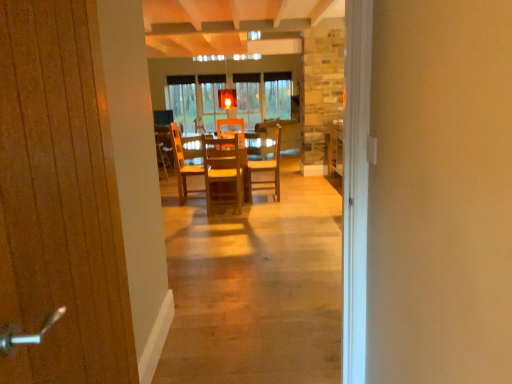
You are a GUI agent. You are given a task and a screenshot of the screen. Output one action in this format:
    pyautogui.click(x=<x>, y=<y>)
    Task: Click on the wooden door at left
    Image resolution: width=512 pixels, height=384 pixels.
    Given the screenshot: What is the action you would take?
    pyautogui.click(x=62, y=193)

In order to face wooden table at center, should I rotate leftwards or rightwards?

It's best to rotate left around 3.550 degrees.

Image resolution: width=512 pixels, height=384 pixels. I want to click on wooden chair at center, so click(x=164, y=148).

The image size is (512, 384). Identify the location of wooden door at left. (62, 193).

How many degrees apart are the facing directions of wooden door at left and wooden table at center?

86.9 degrees separate the facing orientations of wooden door at left and wooden table at center.

Which object is more forward, wooden door at left or wooden table at center?

wooden door at left is closer to the camera.

Considering the sizes of objects wooden door at left and wooden table at center in the image provided, who is thinner, wooden door at left or wooden table at center?

wooden door at left.

Which is more to the right, wooden door at left or wooden table at center?

Positioned to the right is wooden table at center.

Is point (215, 149) less distant than point (74, 173)?

No, it is behind (74, 173).

Consider the image. Which object is positioned more to the left, wooden chair at center, which appears as the first chair when viewed from the front, or wooden door at left?

wooden door at left is more to the left.

The height and width of the screenshot is (384, 512). Find the location of `the 1st chair below the wooden door at left (from a real-world perspective)`. the 1st chair below the wooden door at left (from a real-world perspective) is located at coordinates 223,171.

In terms of height, does wooden chair at center, arranged as the 2th chair when viewed from the right, look taller or shorter compared to wooden door at left?

Considering their sizes, wooden chair at center, arranged as the 2th chair when viewed from the right, has less height than wooden door at left.

Locate an element on the screen. Image resolution: width=512 pixels, height=384 pixels. chair located in front of the wooden table at center is located at coordinates [x=223, y=171].

Is wooden chair at center, which appears as the first chair when viewed from the front, oriented towards wooden table at center?

Yes, wooden chair at center, which appears as the first chair when viewed from the front, is turned towards wooden table at center.

Is the position of wooden chair at center, which appears as the first chair when viewed from the front, less distant than that of wooden table at center?

Yes, wooden chair at center, which appears as the first chair when viewed from the front, is in front of wooden table at center.

Between wooden chair at center, arranged as the 2th chair when viewed from the right, and wooden table at center, which one has larger width?

wooden table at center is wider.

Based on the photo, is wooden chair at center, the second chair in the back-to-front sequence, with wooden chair at center, arranged as the first chair when viewed from the right?

No, wooden chair at center, the second chair in the back-to-front sequence, is not touching wooden chair at center, arranged as the first chair when viewed from the right.

Can you confirm if wooden chair at center, which appears as the first chair when viewed from the front, is thinner than wooden chair at center, which appears as the first chair when viewed from the back?

Yes, wooden chair at center, which appears as the first chair when viewed from the front, is thinner than wooden chair at center, which appears as the first chair when viewed from the back.

Considering the sizes of objects wooden chair at center, the second chair in the back-to-front sequence, and wooden chair at center, arranged as the first chair when viewed from the right, in the image provided, who is shorter, wooden chair at center, the second chair in the back-to-front sequence, or wooden chair at center, arranged as the first chair when viewed from the right,?

Standing shorter between the two is wooden chair at center, the second chair in the back-to-front sequence.

Based on their sizes in the image, would you say wooden chair at center, which appears as the first chair when viewed from the front, is bigger or smaller than wooden chair at center, the 2th chair positioned from the left?

Clearly, wooden chair at center, which appears as the first chair when viewed from the front, is larger in size than wooden chair at center, the 2th chair positioned from the left.

Between point (163, 169) and point (240, 125), which one is positioned in front?

The point (240, 125) is more forward.

What's the angular difference between wooden chair at center and wooden table at center's facing directions?

The facing directions of wooden chair at center and wooden table at center are 92.2 degrees apart.

Does wooden chair at center turn towards wooden table at center?

No, wooden chair at center is not aimed at wooden table at center.

From a real-world perspective, is wooden chair at center beneath wooden table at center?

No, from a real-world perspective, wooden chair at center is not below wooden table at center.

Is point (228, 177) in front of point (163, 160)?

That is True.

Considering the positions of objects wooden chair at center, which appears as the first chair when viewed from the front, and wooden chair at center in the image provided, who is more to the left, wooden chair at center, which appears as the first chair when viewed from the front, or wooden chair at center?

Positioned to the left is wooden chair at center.

Which of these two, wooden chair at center, the 1th chair positioned from the left, or wooden chair at center, is smaller?

wooden chair at center is smaller.

From a real-world perspective, is wooden chair at center, the 1th chair positioned from the left, positioned above or below wooden chair at center?

Result: From a real-world perspective, wooden chair at center, the 1th chair positioned from the left, is physically above wooden chair at center.

From a real-world perspective, is wooden table at center above or below wooden chair at center, which appears as the first chair when viewed from the front?

Clearly, from a real-world perspective, wooden table at center is below wooden chair at center, which appears as the first chair when viewed from the front.

Which is farther from the camera, (255, 135) or (223, 172)?

Point (255, 135)

From the image's perspective, relative to wooden chair at center, arranged as the 2th chair when viewed from the right, is wooden table at center above or below?

Based on their image positions, wooden table at center is located above wooden chair at center, arranged as the 2th chair when viewed from the right.

Considering the relative sizes of wooden table at center and wooden chair at center, which appears as the first chair when viewed from the front, in the image provided, is wooden table at center bigger than wooden chair at center, which appears as the first chair when viewed from the front,?

Yes, wooden table at center is bigger than wooden chair at center, which appears as the first chair when viewed from the front.

This screenshot has height=384, width=512. Identify the location of kitchen & dining room table below the wooden door at left (from a real-world perspective). (269, 163).

Locate an element on the screen. Image resolution: width=512 pixels, height=384 pixels. door in front of the wooden chair at center, arranged as the 2th chair when viewed from the right is located at coordinates (62, 193).

Considering their positions, is wooden chair at center positioned further to wooden chair at center, arranged as the 2th chair when viewed from the front, than wooden table at center?

wooden chair at center is positioned further to the anchor wooden chair at center, arranged as the 2th chair when viewed from the front.

Looking at the image, which one is located closer to wooden chair at center, the 2th chair positioned from the left, wooden table at center or wooden chair at center?

The object closer to wooden chair at center, the 2th chair positioned from the left, is wooden table at center.

Looking at the image, which one is located closer to wooden chair at center, which appears as the first chair when viewed from the front, wooden door at left or wooden table at center?

wooden table at center lies closer to wooden chair at center, which appears as the first chair when viewed from the front, than the other object.

Looking at the image, which one is located closer to wooden table at center, wooden chair at center, arranged as the 2th chair when viewed from the right, or wooden chair at center?

wooden chair at center.

When comparing their distances from wooden table at center, does wooden door at left or wooden chair at center, arranged as the 2th chair when viewed from the front, seem further?

Among the two, wooden door at left is located further to wooden table at center.

Looking at the image, which one is located further to wooden chair at center, the 1th chair positioned from the left, wooden chair at center, the 2th chair positioned from the left, or wooden door at left?

wooden door at left lies further to wooden chair at center, the 1th chair positioned from the left, than the other object.

Estimate the real-world distances between objects in this image. Which object is further from wooden door at left, wooden chair at center or wooden chair at center, which appears as the first chair when viewed from the front?

wooden chair at center is positioned further to the anchor wooden door at left.

Which object lies further to the anchor point wooden door at left, wooden chair at center, arranged as the first chair when viewed from the right, or wooden chair at center, the second chair in the back-to-front sequence?

wooden chair at center, arranged as the first chair when viewed from the right, lies further to wooden door at left than the other object.

I want to click on kitchen & dining room table between wooden chair at center, arranged as the 2th chair when viewed from the right, and wooden chair at center from front to back, so click(269, 163).

Where is `chair positioned between wooden door at left and wooden chair at center, arranged as the first chair when viewed from the right, from near to far`? The image size is (512, 384). chair positioned between wooden door at left and wooden chair at center, arranged as the first chair when viewed from the right, from near to far is located at coordinates (223, 171).

The image size is (512, 384). Identify the location of kitchen & dining room table between wooden chair at center, the 1th chair positioned from the left, and wooden chair at center, arranged as the 2th chair when viewed from the front, in the horizontal direction. (269, 163).

Where is `chair between wooden table at center and wooden chair at center from front to back`? chair between wooden table at center and wooden chair at center from front to back is located at coordinates (270, 165).